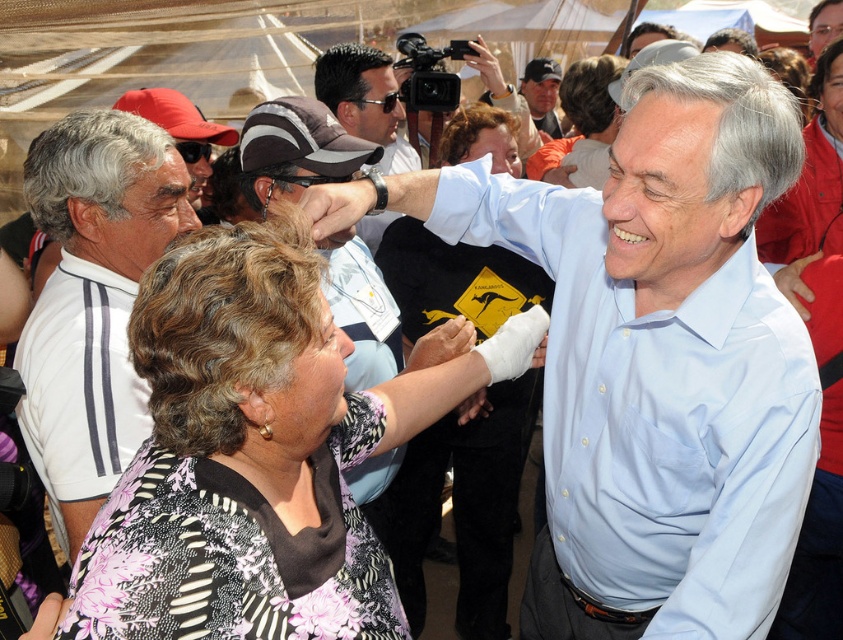
Is light blue shirt at center shorter than matte black cap at upper center?

In fact, light blue shirt at center may be taller than matte black cap at upper center.

Does light blue shirt at center appear under matte black cap at upper center?

Indeed, light blue shirt at center is positioned under matte black cap at upper center.

Which is behind, point (721, 195) or point (543, 104)?

Point (543, 104)

The width and height of the screenshot is (843, 640). Identify the location of light blue shirt at center. (659, 360).

Which of these two, white adidas polo shirt at left or matte gray cap at center, stands shorter?

white adidas polo shirt at left

Can you confirm if white adidas polo shirt at left is shorter than matte gray cap at center?

Yes.

You are a GUI agent. You are given a task and a screenshot of the screen. Output one action in this format:
    pyautogui.click(x=<x>, y=<y>)
    Task: Click on the white adidas polo shirt at left
    The height and width of the screenshot is (640, 843).
    Given the screenshot: What is the action you would take?
    pyautogui.click(x=92, y=300)

Locate an element on the screen. white adidas polo shirt at left is located at coordinates (92, 300).

Does light blue shirt at center have a greater width compared to floral-patterned blouse at center?

Yes, light blue shirt at center is wider than floral-patterned blouse at center.

Is the position of light blue shirt at center more distant than that of floral-patterned blouse at center?

That is True.

Locate an element on the screen. This screenshot has width=843, height=640. light blue shirt at center is located at coordinates (659, 360).